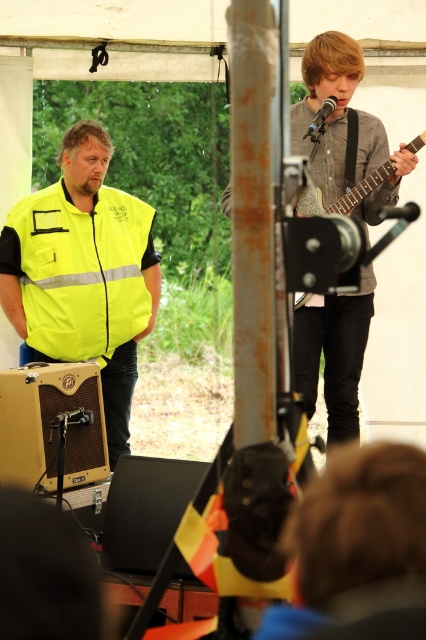
Question: Can you confirm if gray textured shirt at center is thinner than wooden acoustic guitar at upper right?

Choices:
 (A) yes
 (B) no

Answer: (A)

Question: Where is gray textured shirt at center located in relation to wooden acoustic guitar at upper right in the image?

Choices:
 (A) left
 (B) right

Answer: (B)

Question: Which point is farther to the camera?

Choices:
 (A) wooden acoustic guitar at upper right
 (B) yellow reflective vest at left

Answer: (B)

Question: Which point is farther from the camera taking this photo?

Choices:
 (A) (71, 173)
 (B) (363, 180)
 (C) (342, 392)

Answer: (A)

Question: Does yellow reflective vest at left appear on the left side of wooden acoustic guitar at upper right?

Choices:
 (A) yes
 (B) no

Answer: (A)

Question: Which is nearer to the gray textured shirt at center?

Choices:
 (A) yellow reflective vest at left
 (B) wooden acoustic guitar at upper right

Answer: (B)